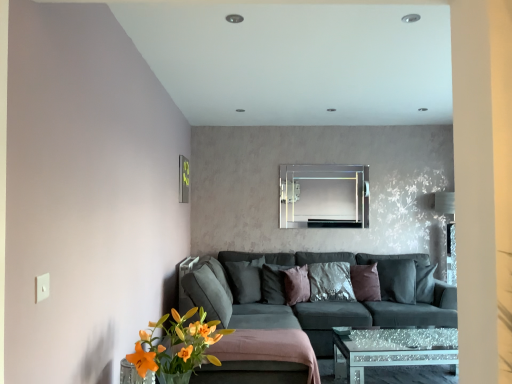
Question: Does metallic rectangular frame at upper left have a greater width compared to clear glass mirror at center?

Choices:
 (A) no
 (B) yes

Answer: (B)

Question: Does metallic rectangular frame at upper left lie behind clear glass mirror at center?

Choices:
 (A) yes
 (B) no

Answer: (B)

Question: From the image's perspective, is metallic rectangular frame at upper left located above clear glass mirror at center?

Choices:
 (A) no
 (B) yes

Answer: (B)

Question: From a real-world perspective, is metallic rectangular frame at upper left located beneath clear glass mirror at center?

Choices:
 (A) yes
 (B) no

Answer: (B)

Question: Is metallic rectangular frame at upper left next to clear glass mirror at center?

Choices:
 (A) no
 (B) yes

Answer: (A)

Question: Considering their positions, is metallic rectangular frame at upper left located in front of or behind dark gray fabric pillow at center, arranged as the first pillow when viewed from the left?

Choices:
 (A) behind
 (B) front

Answer: (B)

Question: From the image's perspective, is metallic rectangular frame at upper left located above or below dark gray fabric pillow at center, arranged as the first pillow when viewed from the left?

Choices:
 (A) below
 (B) above

Answer: (B)

Question: Looking at the image, does metallic rectangular frame at upper left seem bigger or smaller compared to dark gray fabric pillow at center, arranged as the first pillow when viewed from the left?

Choices:
 (A) big
 (B) small

Answer: (B)

Question: From a real-world perspective, relative to dark gray fabric pillow at center, which appears as the fourth pillow when viewed from the right, is metallic rectangular frame at upper left vertically above or below?

Choices:
 (A) below
 (B) above

Answer: (B)

Question: From a real-world perspective, is metallic rectangular frame at upper left above or below shiny metallic pillow at center, which appears as the first pillow when viewed from the right?

Choices:
 (A) below
 (B) above

Answer: (B)

Question: In the image, is metallic rectangular frame at upper left on the left side or the right side of shiny metallic pillow at center, placed as the 4th pillow when sorted from left to right?

Choices:
 (A) left
 (B) right

Answer: (A)

Question: Based on their sizes in the image, would you say metallic rectangular frame at upper left is bigger or smaller than shiny metallic pillow at center, placed as the 4th pillow when sorted from left to right?

Choices:
 (A) small
 (B) big

Answer: (A)

Question: In terms of width, does metallic rectangular frame at upper left look wider or thinner when compared to shiny metallic pillow at center, placed as the 4th pillow when sorted from left to right?

Choices:
 (A) wide
 (B) thin

Answer: (B)

Question: In the image, is dark gray fabric pillow at center, arranged as the first pillow when viewed from the left, positioned in front of or behind orange matte flower at lower left?

Choices:
 (A) behind
 (B) front

Answer: (A)

Question: From a real-world perspective, is dark gray fabric pillow at center, arranged as the first pillow when viewed from the left, physically located above or below orange matte flower at lower left?

Choices:
 (A) below
 (B) above

Answer: (A)